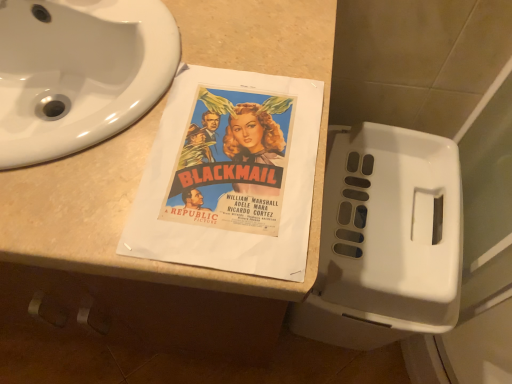
Question: From a real-world perspective, is beige laminate counter top at center over white plastic toilet at right?

Choices:
 (A) no
 (B) yes

Answer: (B)

Question: Is beige laminate counter top at center oriented towards white plastic toilet at right?

Choices:
 (A) no
 (B) yes

Answer: (A)

Question: Is beige laminate counter top at center not close to white plastic toilet at right?

Choices:
 (A) no
 (B) yes

Answer: (A)

Question: Is beige laminate counter top at center not within white plastic toilet at right?

Choices:
 (A) yes
 (B) no

Answer: (A)

Question: Can you confirm if beige laminate counter top at center is bigger than white plastic toilet at right?

Choices:
 (A) no
 (B) yes

Answer: (B)

Question: From the image's perspective, would you say beige laminate counter top at center is positioned over white plastic toilet at right?

Choices:
 (A) no
 (B) yes

Answer: (B)

Question: Can you confirm if beige laminate counter top at center is thinner than white glossy sink at upper left?

Choices:
 (A) yes
 (B) no

Answer: (B)

Question: Is beige laminate counter top at center outside of white glossy sink at upper left?

Choices:
 (A) yes
 (B) no

Answer: (A)

Question: Can you confirm if beige laminate counter top at center is shorter than white glossy sink at upper left?

Choices:
 (A) no
 (B) yes

Answer: (A)

Question: Is beige laminate counter top at center positioned in front of white glossy sink at upper left?

Choices:
 (A) yes
 (B) no

Answer: (A)

Question: From a real-world perspective, is beige laminate counter top at center positioned over white glossy sink at upper left based on gravity?

Choices:
 (A) yes
 (B) no

Answer: (B)

Question: From the image's perspective, would you say beige laminate counter top at center is shown under white glossy sink at upper left?

Choices:
 (A) no
 (B) yes

Answer: (B)

Question: From a real-world perspective, is white glossy sink at upper left beneath white plastic toilet at right?

Choices:
 (A) yes
 (B) no

Answer: (B)